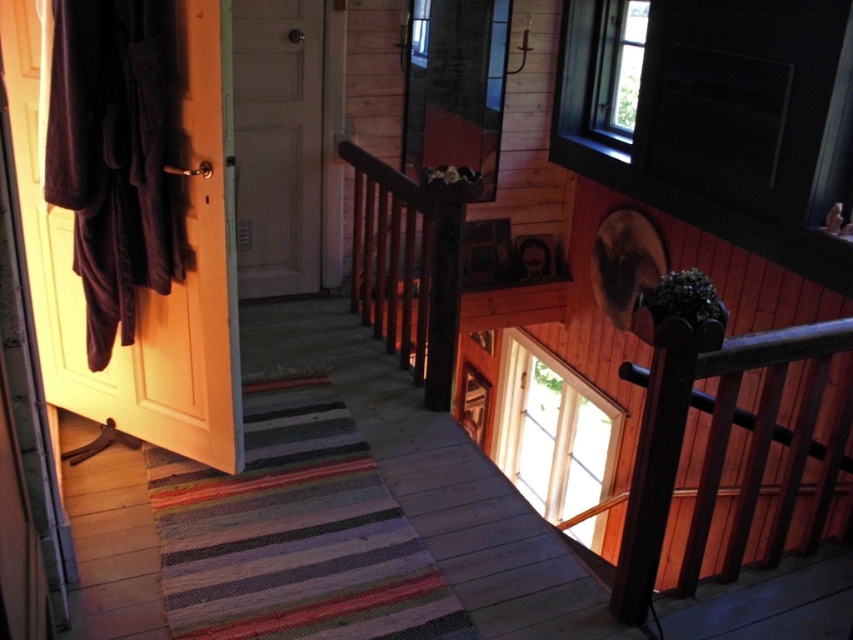
Can you confirm if brown velvety coat at left is positioned above wooden balustrade at upper right?

Indeed, brown velvety coat at left is positioned over wooden balustrade at upper right.

Does brown velvety coat at left have a lesser width compared to wooden balustrade at upper right?

No.

Who is more distant from viewer, (201, 429) or (791, 500)?

The point (201, 429) is behind.

I want to click on brown velvety coat at left, so click(144, 289).

Is wooden balustrade at upper right positioned behind white wood door at center?

No, wooden balustrade at upper right is in front of white wood door at center.

Between point (759, 451) and point (270, 51), which one is positioned behind?

The point (270, 51) is behind.

At what (x,y) coordinates should I click in order to perform the action: click on wooden balustrade at upper right. Please return your answer as a coordinate pair (x, y). Looking at the image, I should click on (724, 445).

In order to click on wooden balustrade at upper right in this screenshot , I will do `click(724, 445)`.

Between point (38, 324) and point (252, 163), which one is positioned behind?

Positioned behind is point (252, 163).

Describe the element at coordinates (144, 289) in the screenshot. This screenshot has height=640, width=853. I see `brown velvety coat at left` at that location.

You are a GUI agent. You are given a task and a screenshot of the screen. Output one action in this format:
    pyautogui.click(x=<x>, y=<y>)
    Task: Click on the brown velvety coat at left
    This screenshot has height=640, width=853.
    Given the screenshot: What is the action you would take?
    pyautogui.click(x=144, y=289)